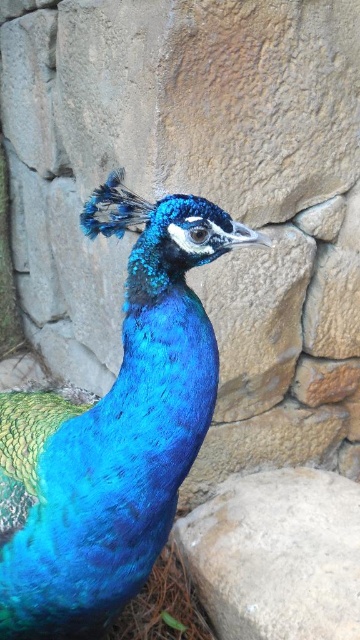
Is shiny blue peacock at center in front of gray rough stone at center?

Yes, shiny blue peacock at center is in front of gray rough stone at center.

Measure the distance between shiny blue peacock at center and camera.

shiny blue peacock at center and camera are 3.30 feet apart.

Does point (51, 596) come closer to viewer compared to point (271, 592)?

That is True.

Find the location of a particular element. shiny blue peacock at center is located at coordinates (113, 442).

Can you confirm if gray rough stone at center is shorter than blue glossy feathers at upper center?

In fact, gray rough stone at center may be taller than blue glossy feathers at upper center.

Does gray rough stone at center lie in front of blue glossy feathers at upper center?

Yes, gray rough stone at center is in front of blue glossy feathers at upper center.

Is point (298, 515) farther from camera compared to point (108, 228)?

Yes, point (298, 515) is farther from viewer.

Image resolution: width=360 pixels, height=640 pixels. What are the coordinates of `gray rough stone at center` in the screenshot? It's located at (276, 556).

Is shiny blue peacock at center above blue glossy feathers at upper center?

No, shiny blue peacock at center is not above blue glossy feathers at upper center.

Can you confirm if shiny blue peacock at center is positioned to the left of blue glossy feathers at upper center?

No, shiny blue peacock at center is not to the left of blue glossy feathers at upper center.

Is point (104, 408) less distant than point (106, 193)?

No, it is behind (106, 193).

Locate an element on the screen. The height and width of the screenshot is (640, 360). shiny blue peacock at center is located at coordinates (113, 442).